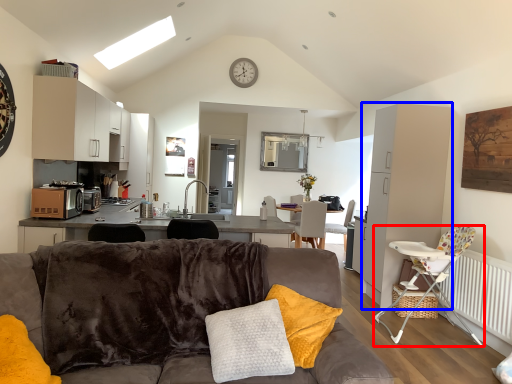
Question: Which point is closer to the camera, chair (highlighted by a red box) or cabinetry (highlighted by a blue box)?

Choices:
 (A) chair
 (B) cabinetry

Answer: (A)